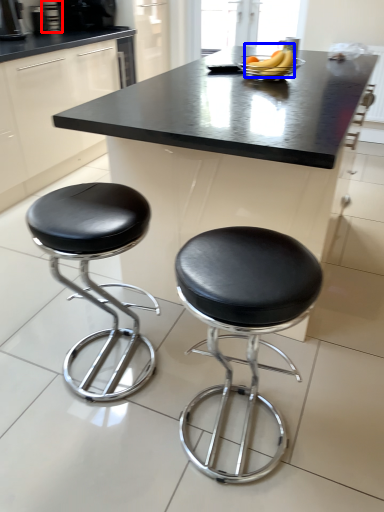
Question: Which point is further to the camera, appliance (highlighted by a red box) or banana (highlighted by a blue box)?

Choices:
 (A) appliance
 (B) banana

Answer: (A)